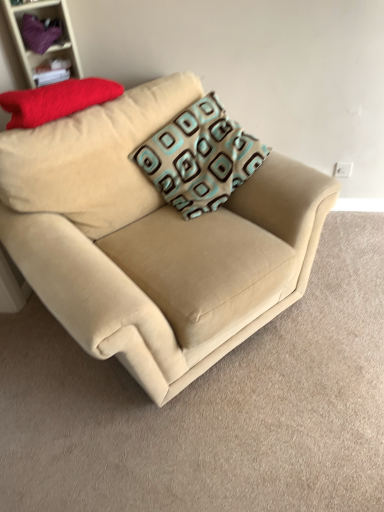
Question: Is matte red pillow at upper left, acting as the 2th pillow starting from the right, far from matte purple fabric at upper left?

Choices:
 (A) yes
 (B) no

Answer: (B)

Question: Considering the relative sizes of matte red pillow at upper left, acting as the 2th pillow starting from the right, and matte purple fabric at upper left in the image provided, is matte red pillow at upper left, acting as the 2th pillow starting from the right, thinner than matte purple fabric at upper left?

Choices:
 (A) no
 (B) yes

Answer: (A)

Question: Is matte red pillow at upper left, acting as the 2th pillow starting from the right, to the right of matte purple fabric at upper left from the viewer's perspective?

Choices:
 (A) yes
 (B) no

Answer: (A)

Question: Is matte red pillow at upper left, acting as the 2th pillow starting from the right, oriented towards matte purple fabric at upper left?

Choices:
 (A) yes
 (B) no

Answer: (B)

Question: Is matte red pillow at upper left, acting as the 2th pillow starting from the right, further to the viewer compared to matte purple fabric at upper left?

Choices:
 (A) yes
 (B) no

Answer: (B)

Question: From the image's perspective, is matte red pillow at upper left, which appears as the 1th pillow when viewed from the left, located beneath matte purple fabric at upper left?

Choices:
 (A) no
 (B) yes

Answer: (B)

Question: Is teal-patterned cushion at center, the 2th pillow viewed from the left, touching matte red pillow at upper left, acting as the 2th pillow starting from the right?

Choices:
 (A) no
 (B) yes

Answer: (A)

Question: From a real-world perspective, is teal-patterned cushion at center, which is the first pillow from right to left, positioned over matte red pillow at upper left, which appears as the 1th pillow when viewed from the left, based on gravity?

Choices:
 (A) yes
 (B) no

Answer: (B)

Question: Does teal-patterned cushion at center, which is the first pillow from right to left, turn towards matte red pillow at upper left, acting as the 2th pillow starting from the right?

Choices:
 (A) no
 (B) yes

Answer: (A)

Question: Is teal-patterned cushion at center, which is the first pillow from right to left, wider than matte red pillow at upper left, which appears as the 1th pillow when viewed from the left?

Choices:
 (A) yes
 (B) no

Answer: (A)

Question: Can we say teal-patterned cushion at center, the 2th pillow viewed from the left, lies outside matte red pillow at upper left, which appears as the 1th pillow when viewed from the left?

Choices:
 (A) no
 (B) yes

Answer: (B)

Question: Does teal-patterned cushion at center, which is the first pillow from right to left, have a smaller size compared to matte red pillow at upper left, which appears as the 1th pillow when viewed from the left?

Choices:
 (A) yes
 (B) no

Answer: (B)

Question: Considering the relative sizes of matte purple fabric at upper left and matte red pillow at upper left, acting as the 2th pillow starting from the right, in the image provided, is matte purple fabric at upper left wider than matte red pillow at upper left, acting as the 2th pillow starting from the right,?

Choices:
 (A) yes
 (B) no

Answer: (B)